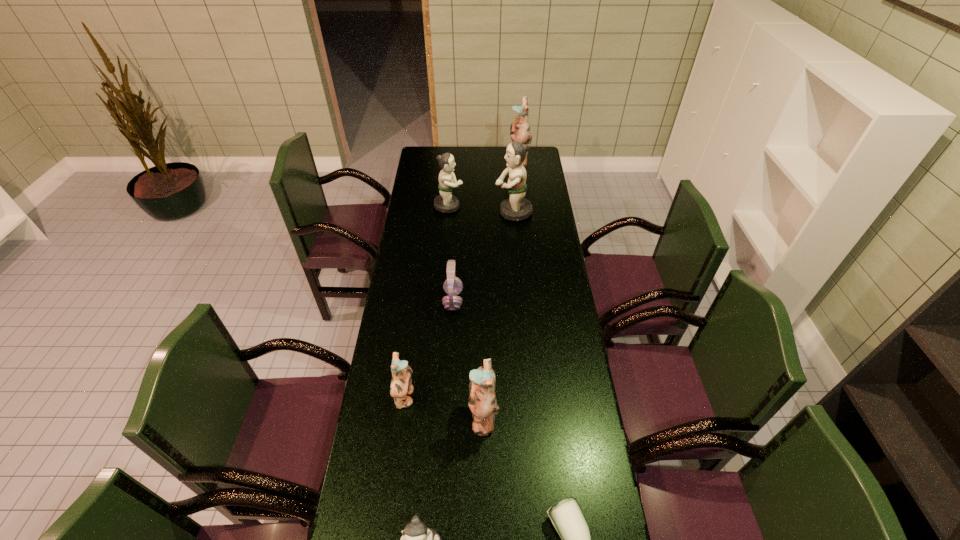
Identify which object is located as the nearest to the nearest green figurine. Please provide its 2D coordinates. Your answer should be formatted as a tuple, i.e. [(x, y)], where the tuple contains the x and y coordinates of a point satisfying the conditions above.

[(482, 400)]

Select which figurine is the second closest to the headset. Please provide its 2D coordinates. Your answer should be formatted as a tuple, i.e. [(x, y)], where the tuple contains the x and y coordinates of a point satisfying the conditions above.

[(482, 400)]

Identify the location of figurine that is the third closest one to the leftmost pink figurine. The width and height of the screenshot is (960, 540). (515, 208).

Find the location of `green figurine that is the second nearest to the nearest figurine`. green figurine that is the second nearest to the nearest figurine is located at coordinates pyautogui.click(x=445, y=202).

You are a GUI agent. You are given a task and a screenshot of the screen. Output one action in this format:
    pyautogui.click(x=<x>, y=<y>)
    Task: Click on the green figurine identified as the second closest to the fourth figurine from left to right
    The height and width of the screenshot is (540, 960).
    Given the screenshot: What is the action you would take?
    pyautogui.click(x=515, y=208)

The height and width of the screenshot is (540, 960). Find the location of `the closest pink figurine relative to the fourth farthest object`. the closest pink figurine relative to the fourth farthest object is located at coordinates (401, 384).

At what (x,y) coordinates should I click in order to perform the action: click on the second closest pink figurine to the second biggest green figurine. Please return your answer as a coordinate pair (x, y). The image size is (960, 540). Looking at the image, I should click on (401, 384).